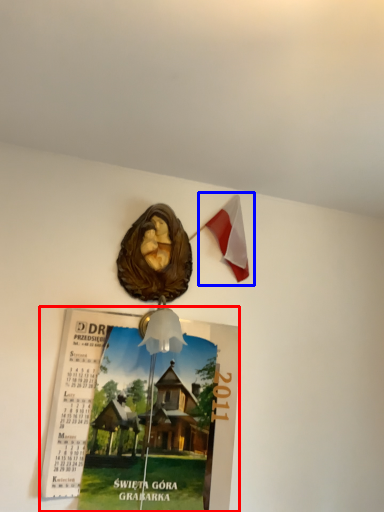
Question: Which of the following is the closest to the observer, poster page (highlighted by a red box) or flag (highlighted by a blue box)?

Choices:
 (A) poster page
 (B) flag

Answer: (A)